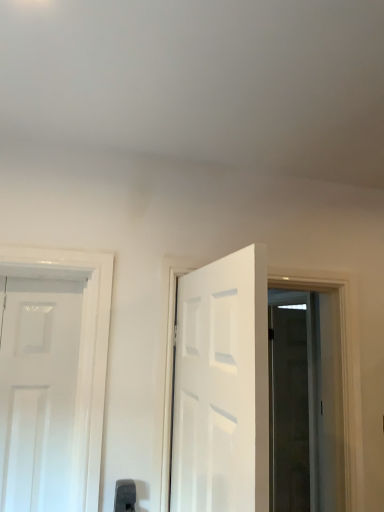
The width and height of the screenshot is (384, 512). Find the location of `black plastic door handle at lower center`. black plastic door handle at lower center is located at coordinates (125, 495).

Is point (346, 476) closer or farther from the camera than point (126, 503)?

Point (346, 476) is farther from the camera than point (126, 503).

From a real-world perspective, which is physically above, transparent glass door at right or black plastic door handle at lower center?

transparent glass door at right, from a real-world perspective.

Between transparent glass door at right and black plastic door handle at lower center, which one has larger size?

With larger size is transparent glass door at right.

Could you tell me if transparent glass door at right is turned towards black plastic door handle at lower center?

No, transparent glass door at right is not aimed at black plastic door handle at lower center.

Between black plastic door handle at lower center and white glossy door at center, which one has less height?

black plastic door handle at lower center is shorter.

Does point (123, 500) appear closer or farther from the camera than point (211, 410)?

Point (123, 500) is farther from the camera than point (211, 410).

Does black plastic door handle at lower center lie in front of white glossy door at center?

No.

From the picture: Does black plastic door handle at lower center turn towards white glossy door at center?

No, black plastic door handle at lower center is not turned towards white glossy door at center.

Considering the points (123, 507) and (349, 418), which point is in front, point (123, 507) or point (349, 418)?

Point (123, 507)

What's the angular difference between black plastic door handle at lower center and transparent glass door at right's facing directions?

90.6 degrees.

Is transparent glass door at right a part of black plastic door handle at lower center?

That's incorrect, transparent glass door at right is not inside black plastic door handle at lower center.

From the image's perspective, relative to transparent glass door at right, is black plastic door handle at lower center above or below?

Based on their image positions, black plastic door handle at lower center is located above transparent glass door at right.

Can you tell me how much transparent glass door at right and white glossy door at center differ in facing direction?

The angular difference between transparent glass door at right and white glossy door at center is 178 degrees.

Considering the positions of objects transparent glass door at right and white glossy door at center in the image provided, who is more to the left, transparent glass door at right or white glossy door at center?

Positioned to the left is white glossy door at center.

From the image's perspective, which one is positioned higher, transparent glass door at right or white glossy door at center?

white glossy door at center is shown above in the image.

Is transparent glass door at right bigger than white glossy door at center?

Yes.

Does white glossy door at center have a greater width compared to transparent glass door at right?

No.

Is the depth of white glossy door at center greater than that of transparent glass door at right?

No, it is not.

Where is `window that appears behind the white glossy door at center`? This screenshot has height=512, width=384. window that appears behind the white glossy door at center is located at coordinates (341, 351).

Which is nearer, (226, 441) or (123, 504)?

The point (226, 441) is more forward.

From the image's perspective, does white glossy door at center appear lower than black plastic door handle at lower center?

No, from the image's perspective, white glossy door at center is not below black plastic door handle at lower center.

Based on the photo, does white glossy door at center have a greater width compared to black plastic door handle at lower center?

Yes, white glossy door at center is wider than black plastic door handle at lower center.

Would you say black plastic door handle at lower center is part of white glossy door at center's contents?

That's incorrect, black plastic door handle at lower center is not inside white glossy door at center.

What are the coordinates of `window that is behind the black plastic door handle at lower center` in the screenshot? It's located at (341, 351).

Find the location of a particular element. The height and width of the screenshot is (512, 384). door handle that is under the white glossy door at center (from a real-world perspective) is located at coordinates (125, 495).

From the picture: When comparing their distances from black plastic door handle at lower center, does white glossy door at center or transparent glass door at right seem closer?

white glossy door at center is positioned closer to the anchor black plastic door handle at lower center.

In the scene shown: Based on their spatial positions, is black plastic door handle at lower center or white glossy door at center further from transparent glass door at right?

black plastic door handle at lower center is further to transparent glass door at right.

Considering their positions, is transparent glass door at right positioned closer to black plastic door handle at lower center than white glossy door at center?

Among the two, white glossy door at center is located nearer to black plastic door handle at lower center.

Based on their spatial positions, is white glossy door at center or black plastic door handle at lower center further from transparent glass door at right?

Among the two, black plastic door handle at lower center is located further to transparent glass door at right.

Which object lies nearer to the anchor point white glossy door at center, black plastic door handle at lower center or transparent glass door at right?

black plastic door handle at lower center.

Based on their spatial positions, is transparent glass door at right or black plastic door handle at lower center closer to white glossy door at center?

Answer: Among the two, black plastic door handle at lower center is located nearer to white glossy door at center.

You are a GUI agent. You are given a task and a screenshot of the screen. Output one action in this format:
    pyautogui.click(x=<x>, y=<y>)
    Task: Click on the door handle between white glossy door at center and transparent glass door at right along the z-axis
    This screenshot has height=512, width=384.
    Given the screenshot: What is the action you would take?
    pyautogui.click(x=125, y=495)